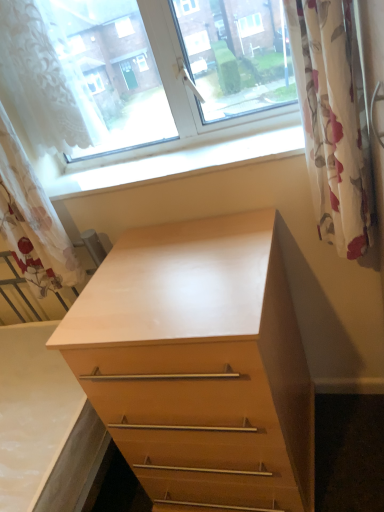
Question: Can you see white lace curtain at left, the 1th curtain in the left-to-right sequence, touching white smooth window sill at upper center?

Choices:
 (A) no
 (B) yes

Answer: (A)

Question: Considering the relative sizes of white lace curtain at left, the 1th curtain in the left-to-right sequence, and white smooth window sill at upper center in the image provided, is white lace curtain at left, the 1th curtain in the left-to-right sequence, bigger than white smooth window sill at upper center?

Choices:
 (A) no
 (B) yes

Answer: (B)

Question: Is white smooth window sill at upper center located within white lace curtain at left, the 1th curtain in the left-to-right sequence?

Choices:
 (A) no
 (B) yes

Answer: (A)

Question: Considering the relative sizes of white lace curtain at left, which is the second curtain from right to left, and white smooth window sill at upper center in the image provided, is white lace curtain at left, which is the second curtain from right to left, shorter than white smooth window sill at upper center?

Choices:
 (A) yes
 (B) no

Answer: (B)

Question: Does white lace curtain at left, the 1th curtain in the left-to-right sequence, appear on the left side of white smooth window sill at upper center?

Choices:
 (A) yes
 (B) no

Answer: (A)

Question: Are white lace curtain at left, which is the second curtain from right to left, and white smooth window sill at upper center located far from each other?

Choices:
 (A) no
 (B) yes

Answer: (A)

Question: Does white smooth window sill at upper center have a greater height compared to floral fabric curtain at right, which is the first curtain in right-to-left order?

Choices:
 (A) yes
 (B) no

Answer: (B)

Question: From the image's perspective, is white smooth window sill at upper center under floral fabric curtain at right, positioned as the second curtain in left-to-right order?

Choices:
 (A) no
 (B) yes

Answer: (A)

Question: Is white smooth window sill at upper center oriented towards floral fabric curtain at right, which is the first curtain in right-to-left order?

Choices:
 (A) no
 (B) yes

Answer: (A)

Question: Does white smooth window sill at upper center come behind floral fabric curtain at right, which is the first curtain in right-to-left order?

Choices:
 (A) yes
 (B) no

Answer: (A)

Question: Is white smooth window sill at upper center to the left of floral fabric curtain at right, positioned as the second curtain in left-to-right order, from the viewer's perspective?

Choices:
 (A) yes
 (B) no

Answer: (A)

Question: Are white smooth window sill at upper center and floral fabric curtain at right, which is the first curtain in right-to-left order, located far from each other?

Choices:
 (A) no
 (B) yes

Answer: (A)

Question: Is light wood chest of drawers at center completely or partially outside of white lace curtain at upper left?

Choices:
 (A) yes
 (B) no

Answer: (A)